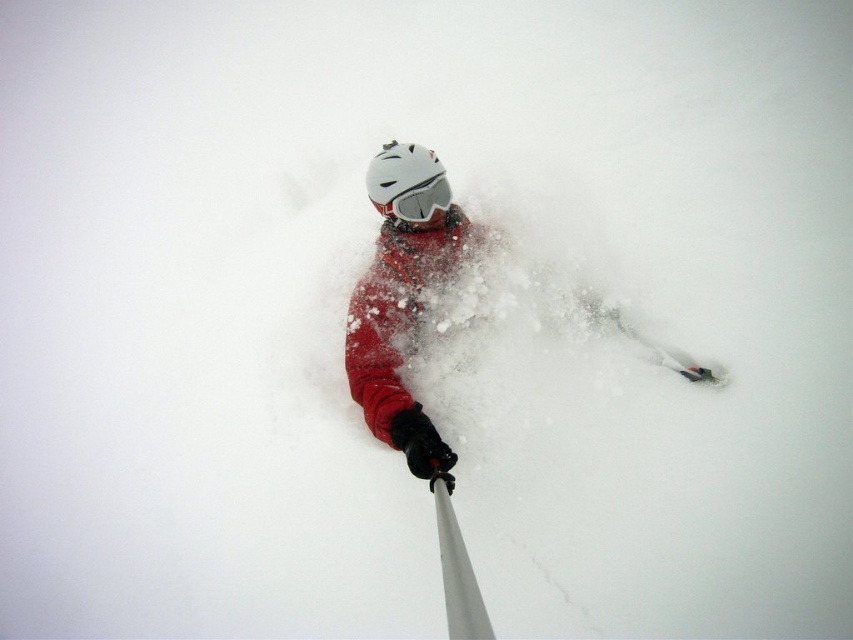
You are a photographer trying to capture the perfect shot of the skier. You notice a point at coordinates point (402,296). What object is located at this point?

The point at coordinates point (402,296) corresponds to the matte red snowboarder at center.

You are navigating a drone through a snowy landscape and need to fly from point A to point B. The coordinates for point A are point A at (421, 456) and point B are point B at (462, 548). Given the skier is moving towards the direction of point B, will you fly towards the skier or away from them when moving from point A to point B?

Point A at (421, 456) is behind point B at (462, 548), so when moving from point A to point B, you are flying towards the direction where the skier is moving. Since the skier is moving towards point B, you are flying towards the skier.